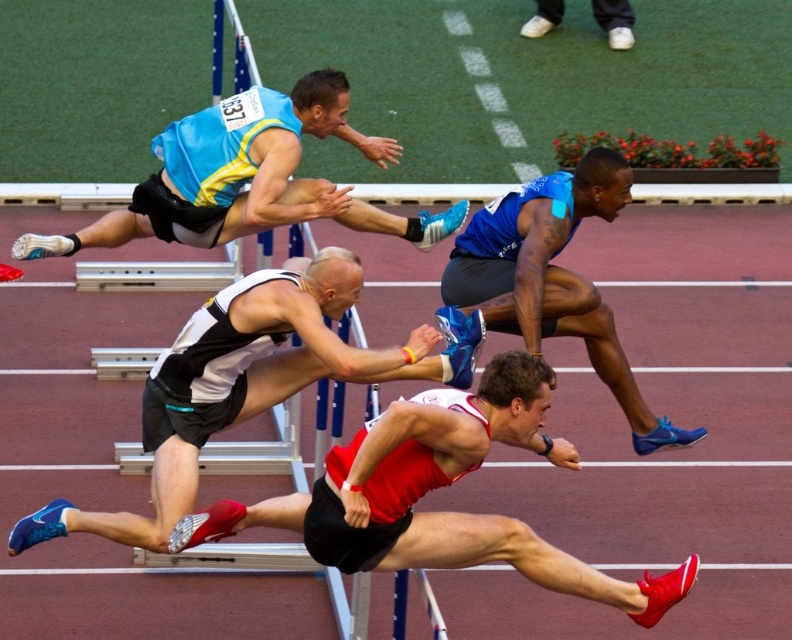
Looking at this image, you are a photographer positioned at the starting line of the track. You want to capture a photo that includes both the white and black athletic shorts at center and the matte blue singlet at upper center. Which object should you zoom in on to ensure both are clearly visible in the frame?

Since the white and black athletic shorts at center occupies less space than matte blue singlet at upper center, you should zoom in on the white and black athletic shorts at center to ensure both objects are clearly visible in the frame.